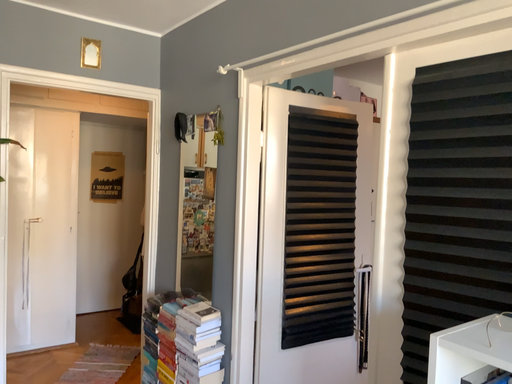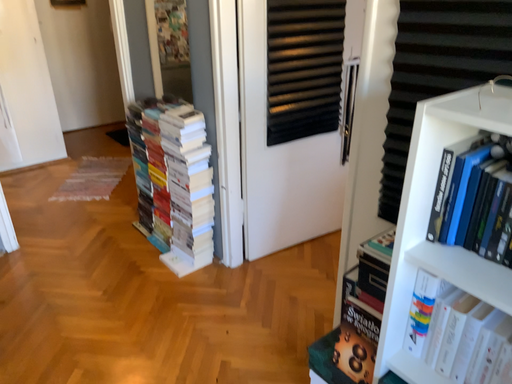
Question: Which way did the camera rotate in the video?

Choices:
 (A) rotated downward
 (B) rotated upward

Answer: (A)